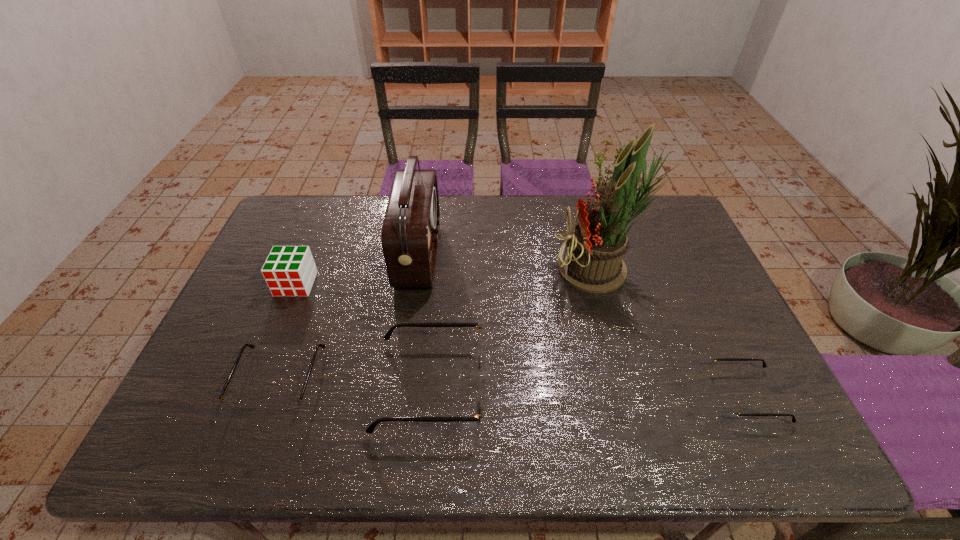
In the image, there is a desktop. Where is `vacant space at the far right corner`? vacant space at the far right corner is located at coordinates (682, 224).

At what (x,y) coordinates should I click in order to perform the action: click on vacant area at the near right corner of the desktop. Please return your answer as a coordinate pair (x, y). This screenshot has height=540, width=960. Looking at the image, I should click on (713, 409).

Identify the location of free spot between the rightmost spectacles and the tallest object. (673, 333).

I want to click on free space between the fifth object from left to right and the rightmost object, so click(x=673, y=333).

Locate an element on the screen. This screenshot has height=540, width=960. vacant space that's between the second object from right to left and the radio receiver is located at coordinates (510, 263).

Locate an element on the screen. This screenshot has height=540, width=960. vacant space in between the second tallest object and the second shortest spectacles is located at coordinates (349, 318).

You are a GUI agent. You are given a task and a screenshot of the screen. Output one action in this format:
    pyautogui.click(x=<x>, y=<y>)
    Task: Click on the vacant space that's between the flower arrangement and the third tallest object
    Image resolution: width=960 pixels, height=540 pixels.
    Given the screenshot: What is the action you would take?
    pyautogui.click(x=448, y=277)

At what (x,y) coordinates should I click in order to perform the action: click on vacant space that's between the leftmost spectacles and the third tallest object. Please return your answer as a coordinate pair (x, y). The width and height of the screenshot is (960, 540). Looking at the image, I should click on (288, 332).

This screenshot has height=540, width=960. Find the location of `vacant space that's between the cube and the fourth tallest object`. vacant space that's between the cube and the fourth tallest object is located at coordinates (364, 335).

Locate an element on the screen. The height and width of the screenshot is (540, 960). vacant area between the leftmost spectacles and the radio receiver is located at coordinates (349, 318).